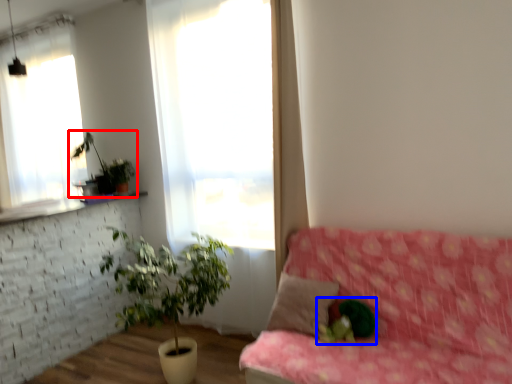
Question: Which point is further to the camera, houseplant (highlighted by a red box) or plant (highlighted by a blue box)?

Choices:
 (A) houseplant
 (B) plant

Answer: (A)